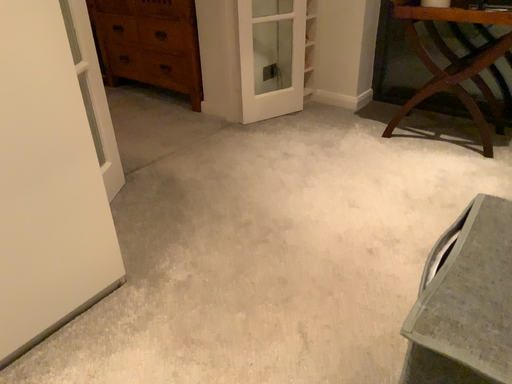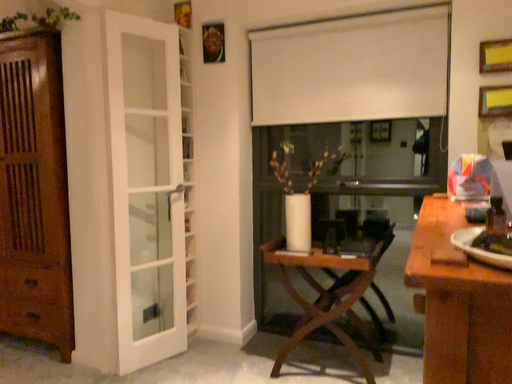
Question: Which way did the camera rotate in the video?

Choices:
 (A) rotated downward
 (B) rotated upward

Answer: (B)